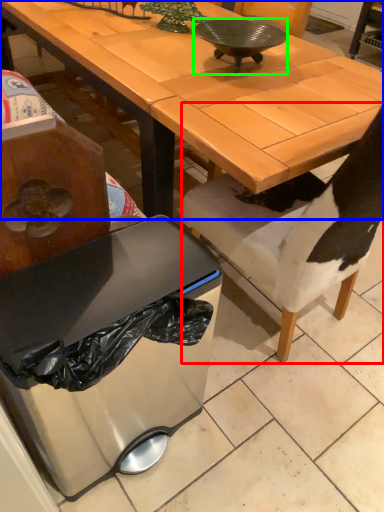
Question: Which object is the farthest from chair (highlighted by a red box)? Choose among these: desk (highlighted by a blue box) or bowl (highlighted by a green box).

Choices:
 (A) desk
 (B) bowl

Answer: (B)